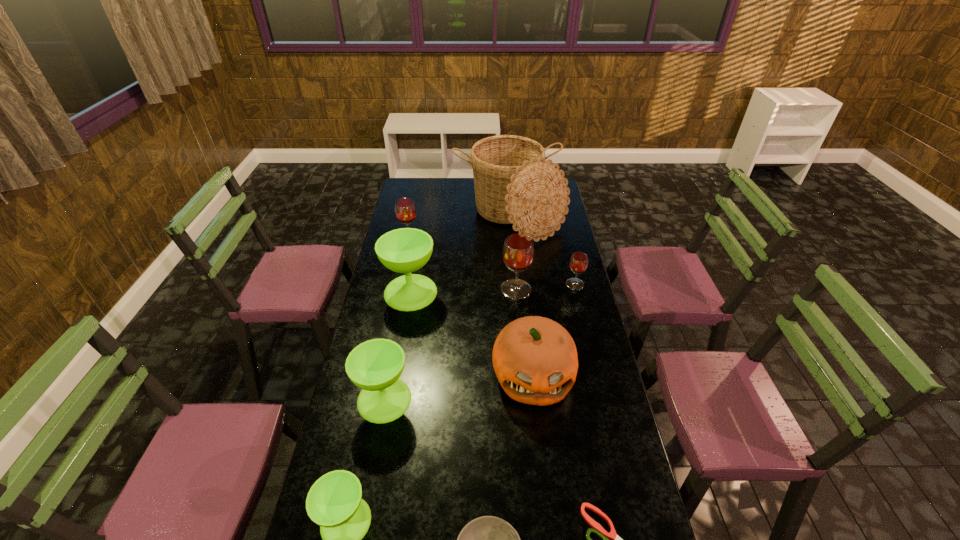
Locate an element on the screen. The width and height of the screenshot is (960, 540). pumpkin present at the right edge is located at coordinates (535, 359).

Where is `wineglass that is at the right edge`? wineglass that is at the right edge is located at coordinates click(x=578, y=263).

This screenshot has height=540, width=960. Identify the location of object located at the far right corner. (514, 184).

The image size is (960, 540). What are the coordinates of `vacant space at the left edge` in the screenshot? It's located at (399, 329).

This screenshot has width=960, height=540. Identify the location of free location at the right edge of the desktop. (556, 313).

Identify the location of free area in between the tallest object and the farthest red wineglass. This screenshot has width=960, height=540. (460, 228).

Where is `free space between the tallest object and the biggest green wineglass`? This screenshot has height=540, width=960. free space between the tallest object and the biggest green wineglass is located at coordinates (460, 255).

Where is `free space that is in between the tallest object and the farthest green wineglass`? free space that is in between the tallest object and the farthest green wineglass is located at coordinates (460, 255).

Identify the location of free spot between the rightmost red wineglass and the biggest green wineglass. This screenshot has height=540, width=960. (492, 288).

Locate an element on the screen. free space that is in between the farthest wineglass and the second biggest green wineglass is located at coordinates (396, 319).